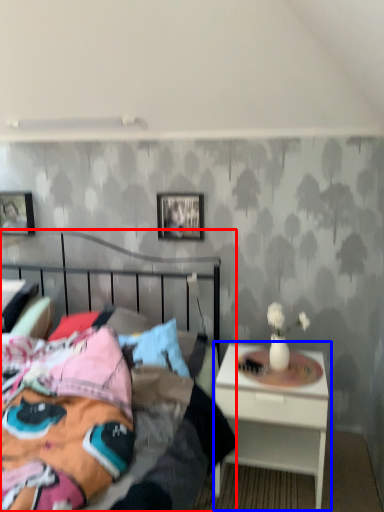
Question: Which object appears closest to the camera in this image, bed (highlighted by a red box) or nightstand (highlighted by a blue box)?

Choices:
 (A) bed
 (B) nightstand

Answer: (A)